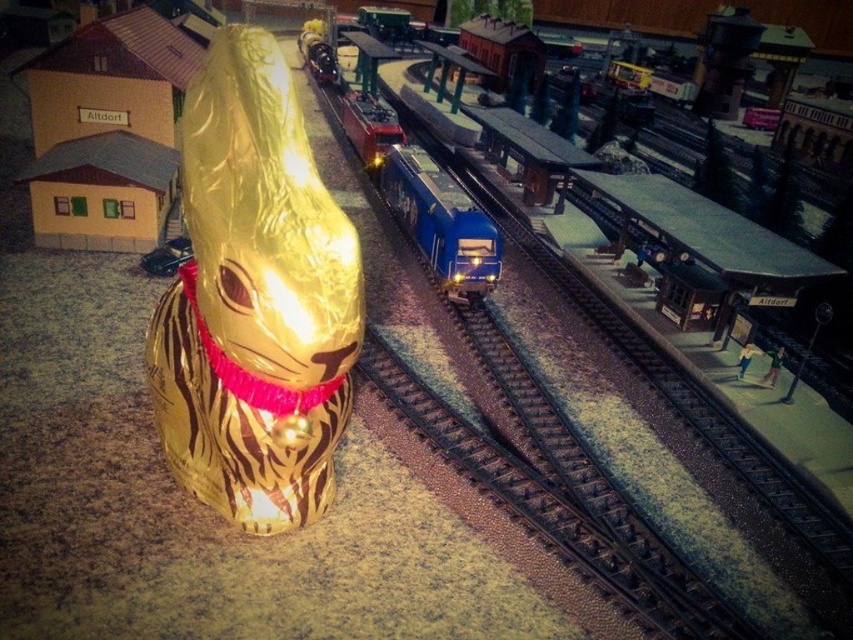
You are a model train enthusiast who wants to place a new miniature train set near the gold foil bunny at left without blocking the view of the bunny. Where should you place the new train set?

You should place the new train set to the right of the gold foil bunny at left since the gold foil bunny at left is located at point (254, 300), which is on the left side of the image, leaving space on the right for the new train set without blocking its view.

You are a model train enthusiast who wants to place a new miniature train on the tracks near the gold foil bunny at left. Based on the coordinates provided, can you confirm if the point at (254, 300) is indeed where the gold foil bunny at left is located?

Yes, according to the coordinates provided, the point at (254, 300) marks the location of the gold foil bunny at left.